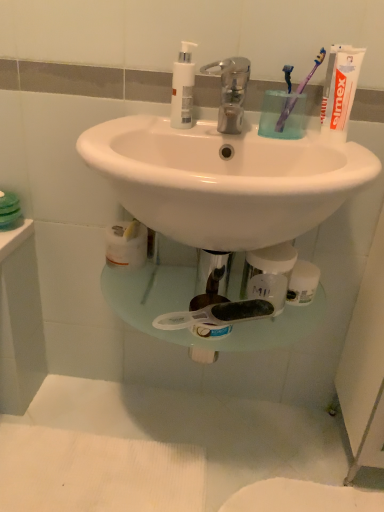
Question: From the image's perspective, is metallic faucet at center above or below white plastic pump bottle at upper center?

Choices:
 (A) above
 (B) below

Answer: (B)

Question: Is point (221, 103) positioned closer to the camera than point (185, 53)?

Choices:
 (A) farther
 (B) closer

Answer: (A)

Question: Estimate the real-world distances between objects in this image. Which object is farther from the white matte toothpaste at upper right?

Choices:
 (A) purple plastic toothbrush at upper right, positioned as the second toothbrush in right-to-left order
 (B) white plastic pump bottle at upper center
 (C) purple plastic toothbrush at upper right, the first toothbrush in the right-to-left sequence
 (D) metallic faucet at center

Answer: (B)

Question: Based on their relative distances, which object is farther from the white plastic pump bottle at upper center?

Choices:
 (A) white matte toothpaste at upper right
 (B) purple plastic toothbrush at upper right, the first toothbrush in the right-to-left sequence
 (C) metallic faucet at center
 (D) purple plastic toothbrush at upper right, placed as the 1th toothbrush when sorted from left to right

Answer: (A)